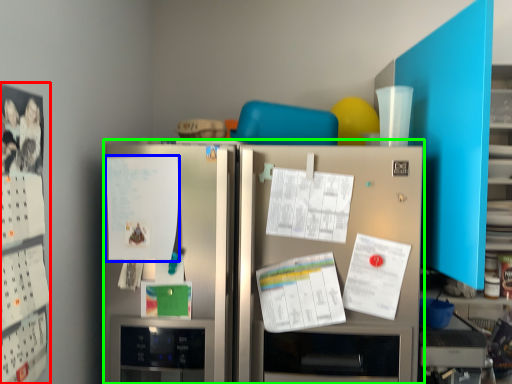
Question: Estimate the real-world distances between objects in this image. Which object is closer to bulletin board (highlighted by a red box), poster (highlighted by a blue box) or refrigerator (highlighted by a green box)?

Choices:
 (A) poster
 (B) refrigerator

Answer: (A)